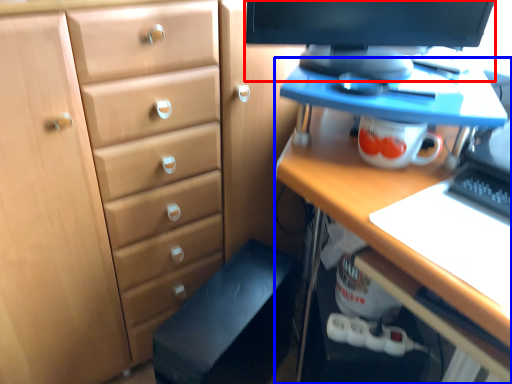
Question: Which object is further to the camera taking this photo, computer monitor (highlighted by a red box) or desk (highlighted by a blue box)?

Choices:
 (A) computer monitor
 (B) desk

Answer: (A)